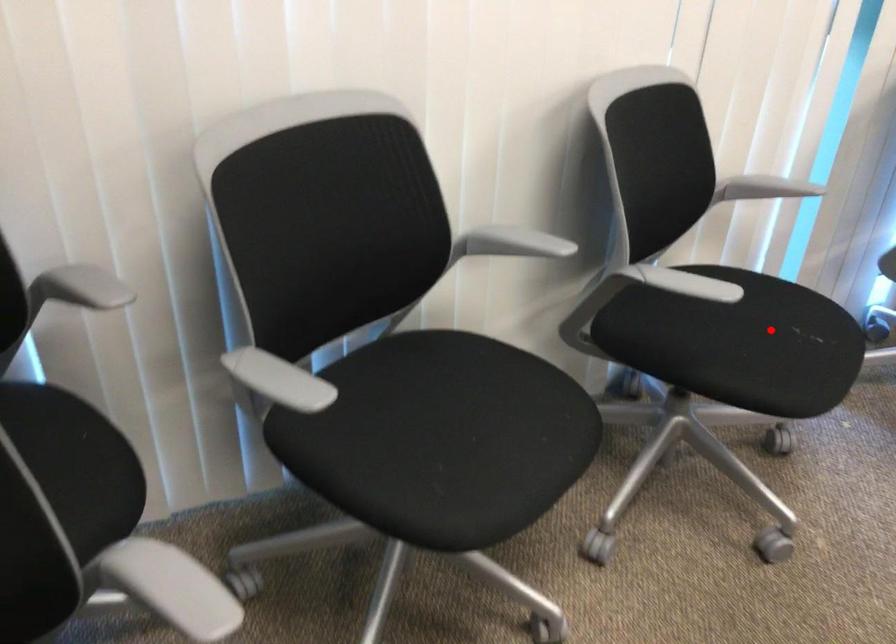
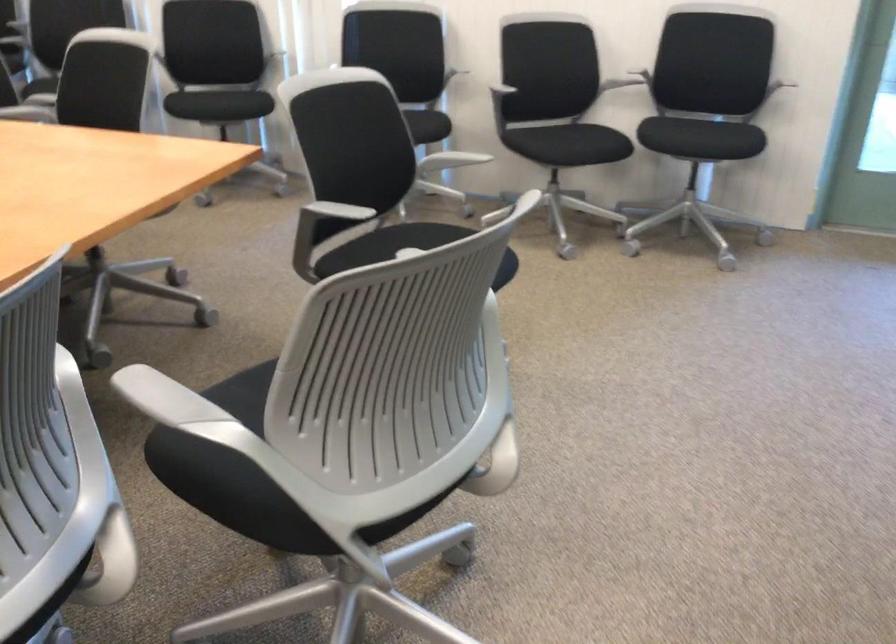
Question: I am providing you with two images of the same scene from different viewpoints. Given a red point in image1, look at the same physical point in image2. Is it:

Choices:
 (A) Closer to the viewpoint
 (B) Farther from the viewpoint

Answer: (B)